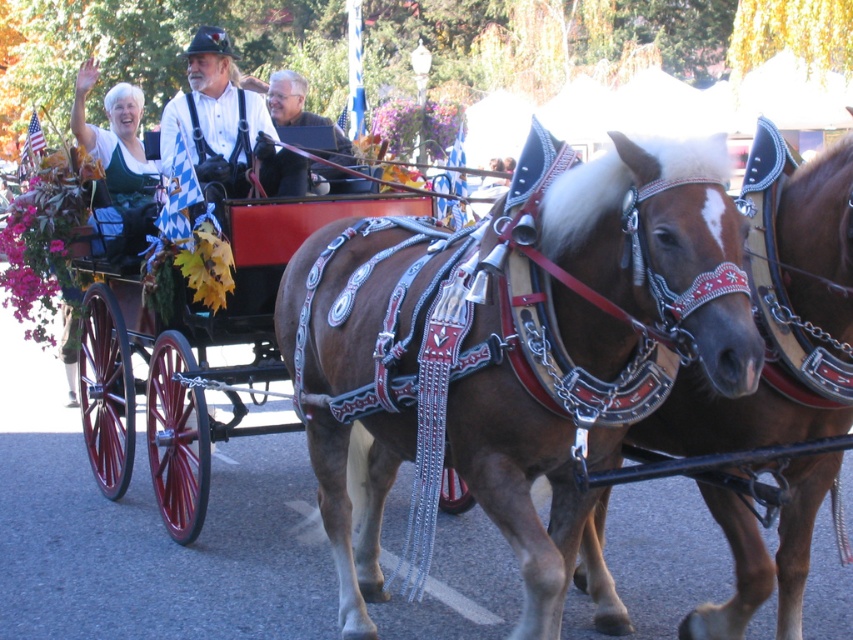
Question: Is brown glossy horse at center wider than matte brown leather jacket at center?

Choices:
 (A) yes
 (B) no

Answer: (A)

Question: Is brown shiny horse at center closer to camera compared to matte brown leather jacket at center?

Choices:
 (A) no
 (B) yes

Answer: (B)

Question: Does matte leather jacket at center appear on the left side of matte brown leather jacket at center?

Choices:
 (A) no
 (B) yes

Answer: (B)

Question: Considering the real-world distances, which object is closest to the brown shiny horse at center?

Choices:
 (A) matte leather jacket at center
 (B) white fabric at upper left

Answer: (A)

Question: Among these objects, which one is farthest from the camera?

Choices:
 (A) matte leather jacket at center
 (B) brown shiny horse at center
 (C) brown glossy horse at center
 (D) white fabric at upper left

Answer: (D)

Question: Among these objects, which one is nearest to the camera?

Choices:
 (A) white fabric at upper left
 (B) brown glossy horse at center
 (C) brown shiny horse at center

Answer: (B)